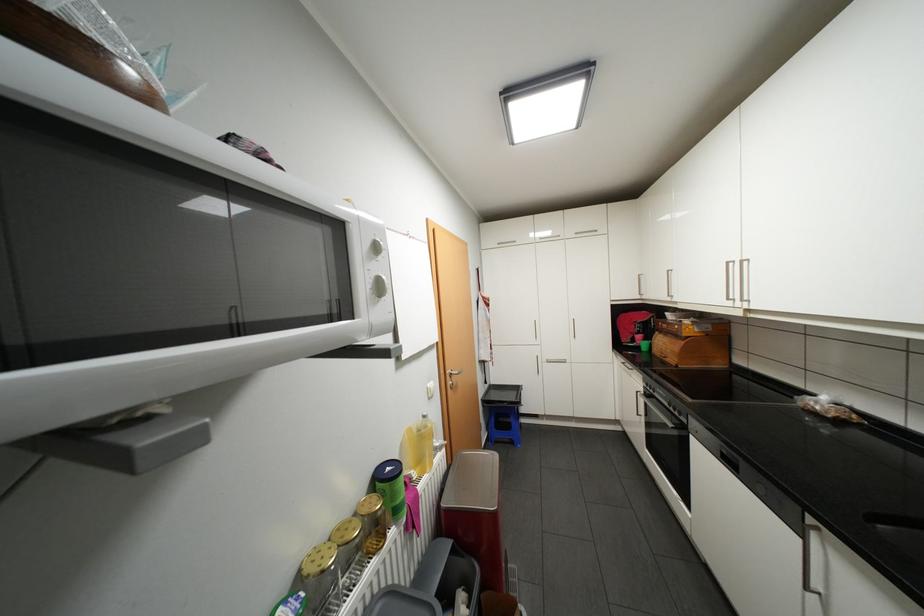
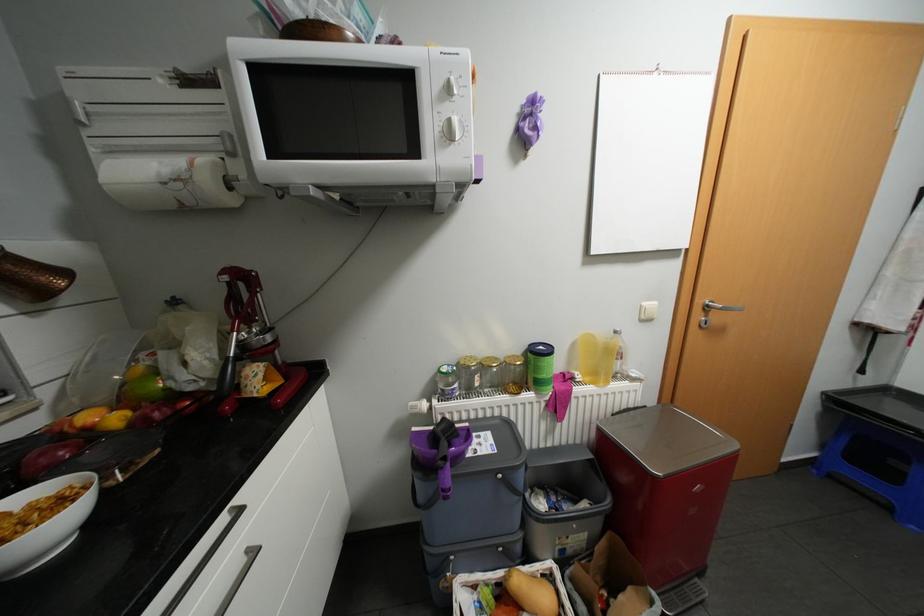
The point at (438, 398) is marked in the first image. Where is the corresponding point in the second image?

(649, 320)